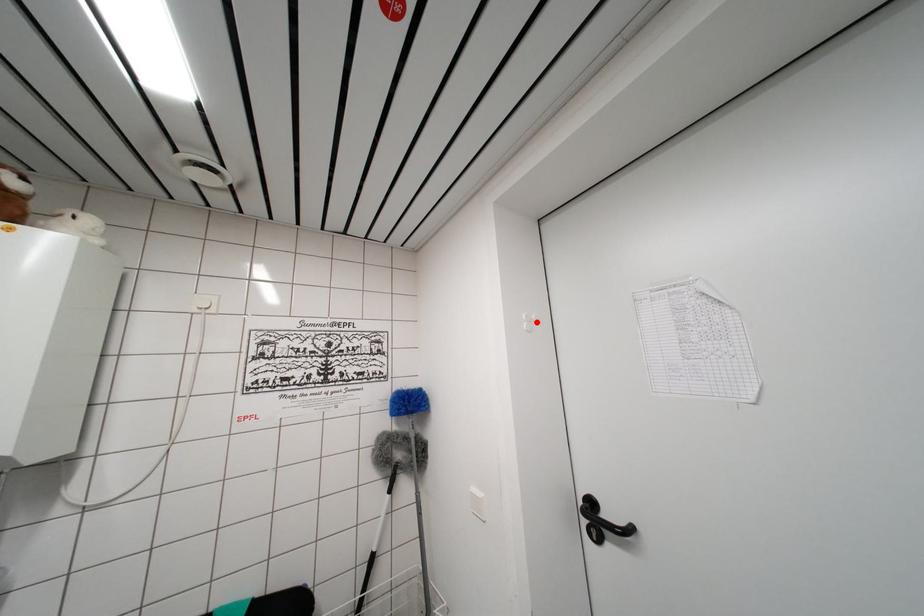
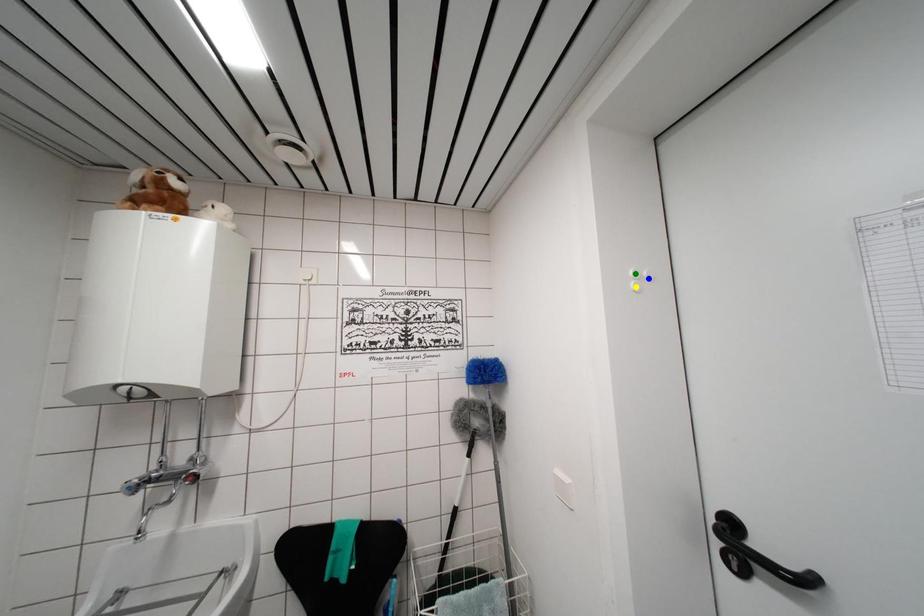
Question: I am providing you with two images of the same scene from different viewpoints. A red point is marked on the first image. You are given multiple points on the second image. Can you choose the point in image 2 that corresponds to the point in image 1?

Choices:
 (A) blue point
 (B) yellow point
 (C) green point

Answer: (A)